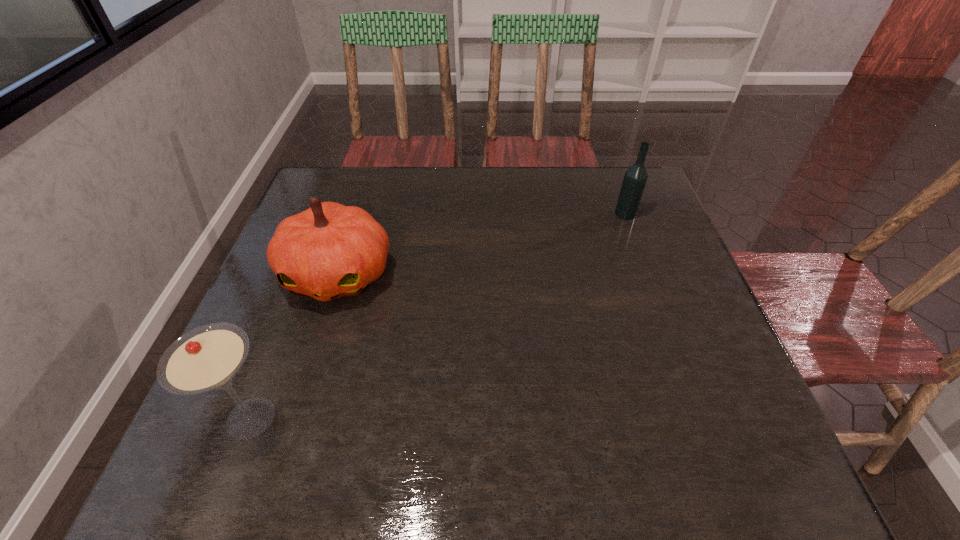
This screenshot has width=960, height=540. Find the location of `unoccupied position between the vodka and the pumpkin`. unoccupied position between the vodka and the pumpkin is located at coordinates (482, 244).

Identify the location of free space between the nearest object and the vodka. (438, 316).

At what (x,y) coordinates should I click in order to perform the action: click on vacant space that's between the vodka and the nearest object. Please return your answer as a coordinate pair (x, y). The image size is (960, 540). Looking at the image, I should click on (438, 316).

Where is `unoccupied area between the farthest object and the pumpkin`? unoccupied area between the farthest object and the pumpkin is located at coordinates (482, 244).

You are a GUI agent. You are given a task and a screenshot of the screen. Output one action in this format:
    pyautogui.click(x=<x>, y=<y>)
    Task: Click on the vacant area between the vodka and the nearest object
    Image resolution: width=960 pixels, height=540 pixels.
    Given the screenshot: What is the action you would take?
    pyautogui.click(x=438, y=316)

Where is `unoccupied position between the martini and the pumpkin`? This screenshot has width=960, height=540. unoccupied position between the martini and the pumpkin is located at coordinates point(295,346).

At what (x,y) coordinates should I click in order to perform the action: click on vacant region between the pumpkin and the farthest object. Please return your answer as a coordinate pair (x, y). The width and height of the screenshot is (960, 540). Looking at the image, I should click on (482, 244).

Locate an element on the screen. The width and height of the screenshot is (960, 540). free space between the second farthest object and the vodka is located at coordinates (482, 244).

Where is `free space between the vodka and the nearest object`? free space between the vodka and the nearest object is located at coordinates (438, 316).

Find the location of a particular element. free area in between the pumpkin and the farthest object is located at coordinates (482, 244).